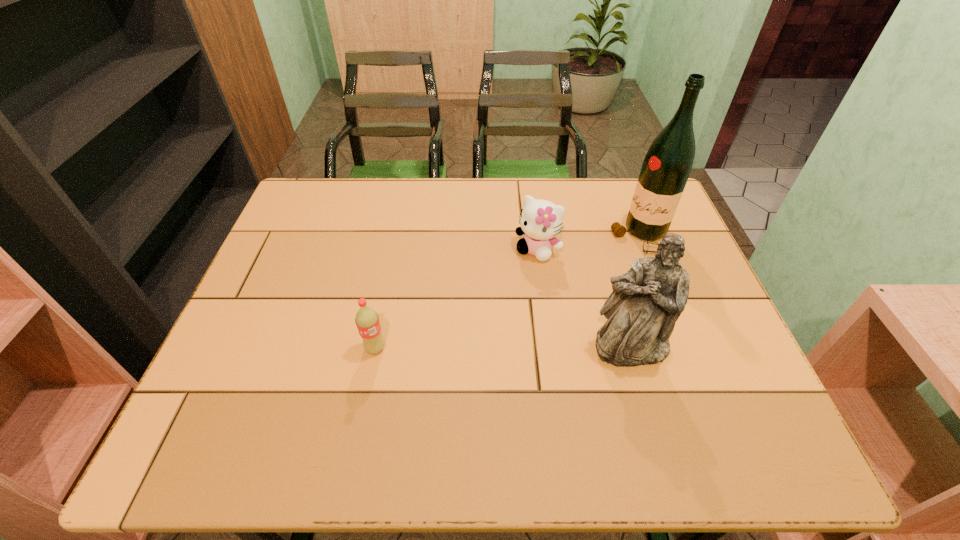
At what (x,y) coordinates should I click in order to perform the action: click on the leftmost object. Please return your answer as a coordinate pair (x, y). Looking at the image, I should click on (367, 321).

Image resolution: width=960 pixels, height=540 pixels. What are the coordinates of `figurine` in the screenshot? It's located at (647, 300).

Where is `the second object from left to right`? Image resolution: width=960 pixels, height=540 pixels. the second object from left to right is located at coordinates (540, 220).

The width and height of the screenshot is (960, 540). What are the coordinates of `the tallest object` in the screenshot? It's located at (667, 165).

Image resolution: width=960 pixels, height=540 pixels. I want to click on vacant space positioned on the right of the leftmost object, so pos(519,348).

I want to click on vacant area located 0.100m on the front-facing side of the second tallest object, so click(x=649, y=411).

The height and width of the screenshot is (540, 960). What are the coordinates of `vacant space situated 0.270m on the front-facing side of the kitten` in the screenshot? It's located at (477, 332).

You are a GUI agent. You are given a task and a screenshot of the screen. Output one action in this format:
    pyautogui.click(x=<x>, y=<y>)
    Task: Click on the blank area located 0.290m on the front-facing side of the kitten
    The height and width of the screenshot is (540, 960).
    Given the screenshot: What is the action you would take?
    (x=473, y=338)

What are the coordinates of `vacant point located on the front-facing side of the kitten` in the screenshot? It's located at click(x=488, y=318).

This screenshot has width=960, height=540. What are the coordinates of `vacant space positioned 0.390m on the surface of the wine bottle` in the screenshot? It's located at (536, 334).